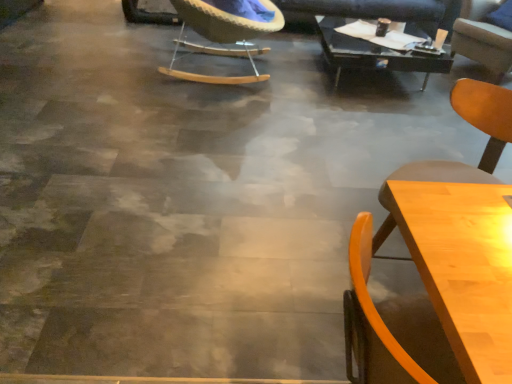
Identify the location of woven fabric chair at upper center, marked as the 3th chair in a right-to-left arrangement. The width and height of the screenshot is (512, 384). [226, 30].

This screenshot has width=512, height=384. I want to click on light brown wood chair at upper right, the first chair in the back-to-front sequence, so click(482, 39).

I want to click on light wood chair at lower right, arranged as the first chair when viewed from the front, so click(474, 126).

Identify the location of wooden table at lower right, which is the 1th table from front to back. (461, 265).

Identify the location of woven fabric chair at upper center, which is counted as the second chair, starting from the front. This screenshot has height=384, width=512. (226, 30).

In the image, is light wood chair at lower right, positioned as the second chair in left-to-right order, positioned in front of or behind light brown wood chair at upper right, the 3th chair positioned from the left?

Clearly, light wood chair at lower right, positioned as the second chair in left-to-right order, is in front of light brown wood chair at upper right, the 3th chair positioned from the left.

Is light wood chair at lower right, positioned as the second chair in left-to-right order, to the left or to the right of light brown wood chair at upper right, which is counted as the 1th chair, starting from the right, in the image?

light wood chair at lower right, positioned as the second chair in left-to-right order, is to the left of light brown wood chair at upper right, which is counted as the 1th chair, starting from the right.

Looking at this image, from the image's perspective, is light wood chair at lower right, positioned as the second chair in left-to-right order, above light brown wood chair at upper right, positioned as the third chair in front-to-back order?

Actually, light wood chair at lower right, positioned as the second chair in left-to-right order, appears below light brown wood chair at upper right, positioned as the third chair in front-to-back order, in the image.

Is light wood chair at lower right, arranged as the first chair when viewed from the front, oriented away from woven fabric chair at upper center, which is counted as the second chair, starting from the front?

light wood chair at lower right, arranged as the first chair when viewed from the front, does not have its back to woven fabric chair at upper center, which is counted as the second chair, starting from the front.

Looking at their sizes, would you say light wood chair at lower right, positioned as the second chair in left-to-right order, is wider or thinner than woven fabric chair at upper center, the second chair when ordered from back to front?

Considering their sizes, light wood chair at lower right, positioned as the second chair in left-to-right order, looks slimmer than woven fabric chair at upper center, the second chair when ordered from back to front.

From a real-world perspective, is light wood chair at lower right, the 2th chair when ordered from right to left, positioned over woven fabric chair at upper center, marked as the 3th chair in a right-to-left arrangement, based on gravity?

Yes, from a real-world perspective, light wood chair at lower right, the 2th chair when ordered from right to left, is over woven fabric chair at upper center, marked as the 3th chair in a right-to-left arrangement

How many degrees apart are the facing directions of light wood chair at lower right, positioned as the second chair in left-to-right order, and woven fabric chair at upper center, which is counted as the second chair, starting from the front?

135 degrees separate the facing orientations of light wood chair at lower right, positioned as the second chair in left-to-right order, and woven fabric chair at upper center, which is counted as the second chair, starting from the front.

Image resolution: width=512 pixels, height=384 pixels. I want to click on table that appears above the light brown wood chair at upper right, which is counted as the 1th chair, starting from the right (from a real-world perspective), so click(x=461, y=265).

From the picture: Can you confirm if light brown wood chair at upper right, which is counted as the 1th chair, starting from the right, is bigger than wooden table at lower right, the second table when ordered from top to bottom?

Yes, light brown wood chair at upper right, which is counted as the 1th chair, starting from the right, is bigger than wooden table at lower right, the second table when ordered from top to bottom.

Looking at this image, from a real-world perspective, between light brown wood chair at upper right, the 3th chair positioned from the left, and wooden table at lower right, the second table viewed from the right, who is vertically higher?

From a 3D spatial view, wooden table at lower right, the second table viewed from the right, is above.

Who is taller, light brown wood chair at upper right, which is counted as the 1th chair, starting from the right, or wooden table at lower right, the 1th table from the left?

wooden table at lower right, the 1th table from the left, is taller.

This screenshot has width=512, height=384. What are the coordinates of `table that appears above the light wood chair at lower right, arranged as the 3th chair when viewed from the back (from a real-world perspective)` in the screenshot? It's located at (461, 265).

Does light wood chair at lower right, arranged as the 3th chair when viewed from the back, have a smaller size compared to wooden table at lower right, the second table viewed from the right?

Yes.

Which is correct: light wood chair at lower right, positioned as the second chair in left-to-right order, is inside wooden table at lower right, the second table viewed from the right, or outside of it?

light wood chair at lower right, positioned as the second chair in left-to-right order, is spatially situated outside wooden table at lower right, the second table viewed from the right.

Choose the correct answer: Is black glass table at upper center, the second table when ordered from left to right, inside woven fabric chair at upper center, the second chair when ordered from back to front, or outside it?

black glass table at upper center, the second table when ordered from left to right, is outside woven fabric chair at upper center, the second chair when ordered from back to front.

Considering the sizes of black glass table at upper center, the 1th table viewed from the top, and woven fabric chair at upper center, which is counted as the second chair, starting from the front, in the image, is black glass table at upper center, the 1th table viewed from the top, taller or shorter than woven fabric chair at upper center, which is counted as the second chair, starting from the front,?

In the image, black glass table at upper center, the 1th table viewed from the top, appears to be shorter than woven fabric chair at upper center, which is counted as the second chair, starting from the front.

This screenshot has width=512, height=384. I want to click on table directly beneath the woven fabric chair at upper center, which is counted as the second chair, starting from the front (from a real-world perspective), so click(373, 53).

Consider the image. Is black glass table at upper center, the 1th table viewed from the top, in front of or behind woven fabric chair at upper center, which is counted as the second chair, starting from the front, in the image?

In the image, black glass table at upper center, the 1th table viewed from the top, appears behind woven fabric chair at upper center, which is counted as the second chair, starting from the front.

Do you think wooden table at lower right, the second table when ordered from top to bottom, is within light wood chair at lower right, arranged as the 3th chair when viewed from the back, or outside of it?

The correct answer is: outside.

Relative to light wood chair at lower right, the 2th chair when ordered from right to left, is wooden table at lower right, arranged as the first table when ordered from the bottom, in front or behind?

wooden table at lower right, arranged as the first table when ordered from the bottom, is positioned closer to the viewer than light wood chair at lower right, the 2th chair when ordered from right to left.

Between wooden table at lower right, which is the 1th table from front to back, and light wood chair at lower right, positioned as the second chair in left-to-right order, which one has larger width?

Wider between the two is light wood chair at lower right, positioned as the second chair in left-to-right order.

From the picture: Is light brown wood chair at upper right, the first chair in the back-to-front sequence, with light wood chair at lower right, the 2th chair when ordered from right to left?

No, light brown wood chair at upper right, the first chair in the back-to-front sequence, is not next to light wood chair at lower right, the 2th chair when ordered from right to left.

Is light brown wood chair at upper right, which is counted as the 1th chair, starting from the right, oriented away from light wood chair at lower right, arranged as the 3th chair when viewed from the back?

No, light brown wood chair at upper right, which is counted as the 1th chair, starting from the right,'s orientation is not away from light wood chair at lower right, arranged as the 3th chair when viewed from the back.

This screenshot has height=384, width=512. I want to click on the 2nd chair behind when counting from the light wood chair at lower right, arranged as the first chair when viewed from the front, so click(x=482, y=39).

Is light brown wood chair at upper right, positioned as the third chair in front-to-back order, bigger or smaller than light wood chair at lower right, arranged as the 3th chair when viewed from the back?

Clearly, light brown wood chair at upper right, positioned as the third chair in front-to-back order, is larger in size than light wood chair at lower right, arranged as the 3th chair when viewed from the back.

Image resolution: width=512 pixels, height=384 pixels. What are the coordinates of `the 2nd chair in front of the light brown wood chair at upper right, which is counted as the 1th chair, starting from the right` in the screenshot? It's located at (474, 126).

From the image's perspective, starting from the light wood chair at lower right, arranged as the 3th chair when viewed from the back, which chair is the 1st one above? Please provide its 2D coordinates.

[(226, 30)]

Considering their positions, is woven fabric chair at upper center, marked as the 3th chair in a right-to-left arrangement, positioned further to light wood chair at lower right, arranged as the 3th chair when viewed from the back, than wooden table at lower right, the second table when ordered from top to bottom?

woven fabric chair at upper center, marked as the 3th chair in a right-to-left arrangement, lies further to light wood chair at lower right, arranged as the 3th chair when viewed from the back, than the other object.

Looking at the image, which one is located further to black glass table at upper center, which is counted as the first table, starting from the back, woven fabric chair at upper center, the second chair when ordered from back to front, or light wood chair at lower right, the 2th chair when ordered from right to left?

Among the two, light wood chair at lower right, the 2th chair when ordered from right to left, is located further to black glass table at upper center, which is counted as the first table, starting from the back.

Considering their positions, is woven fabric chair at upper center, which is counted as the second chair, starting from the front, positioned closer to light brown wood chair at upper right, positioned as the third chair in front-to-back order, than wooden table at lower right, arranged as the first table when ordered from the bottom?

Based on the image, woven fabric chair at upper center, which is counted as the second chair, starting from the front, appears to be nearer to light brown wood chair at upper right, positioned as the third chair in front-to-back order.

Based on their spatial positions, is wooden table at lower right, arranged as the first table when ordered from the bottom, or woven fabric chair at upper center, which is counted as the second chair, starting from the front, closer to light brown wood chair at upper right, which is counted as the 1th chair, starting from the right?

woven fabric chair at upper center, which is counted as the second chair, starting from the front, is closer to light brown wood chair at upper right, which is counted as the 1th chair, starting from the right.

Estimate the real-world distances between objects in this image. Which object is further from woven fabric chair at upper center, marked as the 3th chair in a right-to-left arrangement, light wood chair at lower right, the 2th chair when ordered from right to left, or wooden table at lower right, arranged as the first table when ordered from the bottom?

Based on the image, wooden table at lower right, arranged as the first table when ordered from the bottom, appears to be further to woven fabric chair at upper center, marked as the 3th chair in a right-to-left arrangement.

When comparing their distances from woven fabric chair at upper center, the second chair when ordered from back to front, does light wood chair at lower right, positioned as the second chair in left-to-right order, or black glass table at upper center, marked as the 2th table in a front-to-back arrangement, seem further?

light wood chair at lower right, positioned as the second chair in left-to-right order, lies further to woven fabric chair at upper center, the second chair when ordered from back to front, than the other object.

Consider the image. Estimate the real-world distances between objects in this image. Which object is further from woven fabric chair at upper center, marked as the 3th chair in a right-to-left arrangement, wooden table at lower right, the second table when ordered from top to bottom, or light brown wood chair at upper right, positioned as the third chair in front-to-back order?

wooden table at lower right, the second table when ordered from top to bottom, lies further to woven fabric chair at upper center, marked as the 3th chair in a right-to-left arrangement, than the other object.

From the image, which object appears to be nearer to black glass table at upper center, which is counted as the first table, starting from the back, wooden table at lower right, arranged as the first table when ordered from the bottom, or light wood chair at lower right, arranged as the 3th chair when viewed from the back?

Among the two, light wood chair at lower right, arranged as the 3th chair when viewed from the back, is located nearer to black glass table at upper center, which is counted as the first table, starting from the back.

What are the coordinates of `chair between woven fabric chair at upper center, the first chair viewed from the left, and light brown wood chair at upper right, positioned as the third chair in front-to-back order` in the screenshot? It's located at (474, 126).

At what (x,y) coordinates should I click in order to perform the action: click on chair between wooden table at lower right, arranged as the first table when ordered from the bottom, and woven fabric chair at upper center, which is counted as the second chair, starting from the front, in the front-back direction. Please return your answer as a coordinate pair (x, y). The height and width of the screenshot is (384, 512). Looking at the image, I should click on (474, 126).